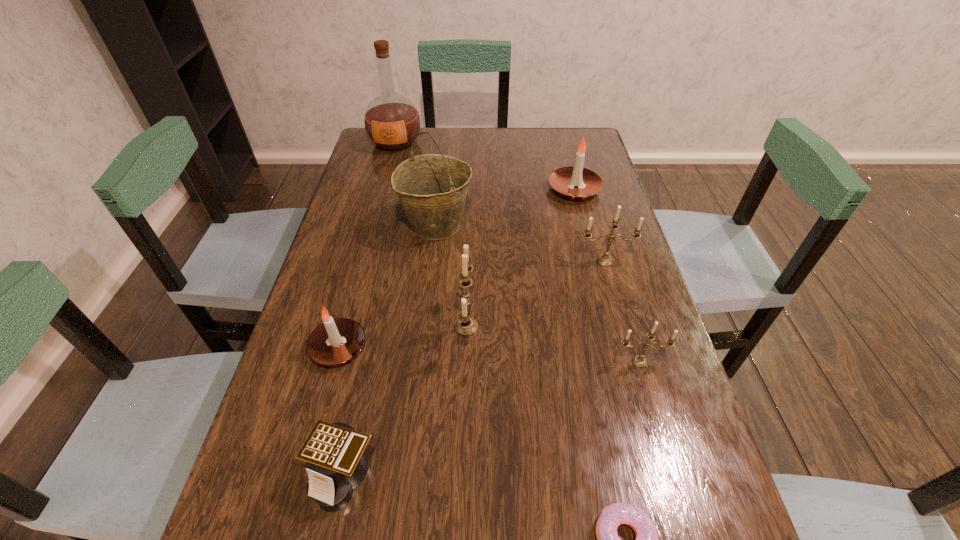
The width and height of the screenshot is (960, 540). I want to click on candle that stands as the fourth closest to the doughnut, so click(x=605, y=260).

Locate which candle is the fourth closest to the second tallest object. Please provide its 2D coordinates. Your answer should be formatted as a tuple, i.e. [(x, y)], where the tuple contains the x and y coordinates of a point satisfying the conditions above.

[(605, 260)]

Identify the location of metallic candle that stands as the second closest to the sixth nearest object. The image size is (960, 540). (466, 326).

The image size is (960, 540). I want to click on the closest metallic candle to the second smallest metallic candle, so click(639, 361).

Identify the location of free space in the image that satisfies the following two spatial constraints: 1. on the front label of the farthest object; 2. on the left side of the smallest metallic candle. (338, 362).

Identify the location of free space that satisfies the following two spatial constraints: 1. on the front label of the wine bucket; 2. on the left side of the liquor. The image size is (960, 540). (373, 225).